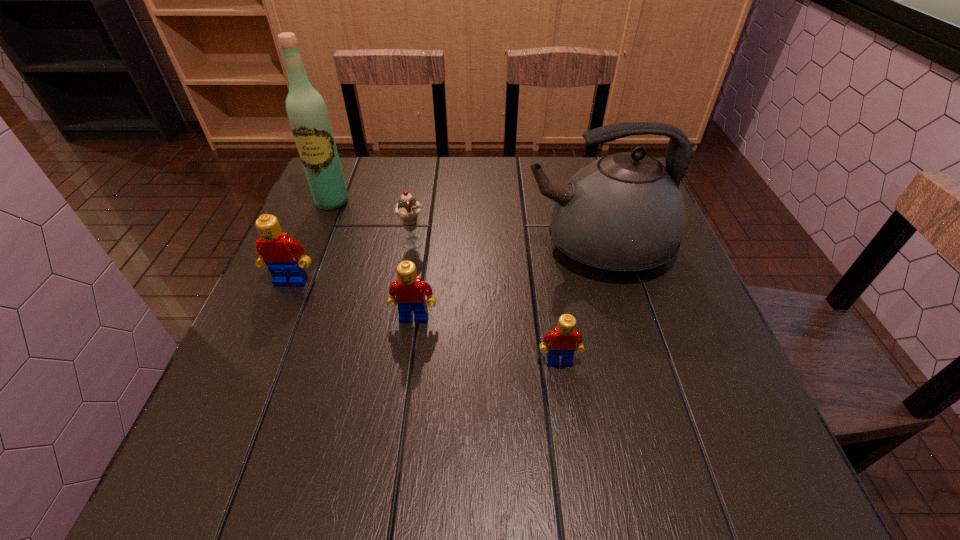
Find the location of a particular element. This screenshot has height=540, width=960. vacant position located on the front-facing side of the second nearest Lego is located at coordinates (402, 409).

Locate an element on the screen. Image resolution: width=960 pixels, height=540 pixels. vacant space located on the front-facing side of the shortest object is located at coordinates (564, 398).

Find the location of a particular element. The image size is (960, 540). blank area located 0.270m on the front-facing side of the tallest object is located at coordinates (298, 289).

Where is `free space located at the spout of the fifth shortest object`? The height and width of the screenshot is (540, 960). free space located at the spout of the fifth shortest object is located at coordinates (471, 247).

I want to click on vacant space positioned 0.380m at the spout of the fifth shortest object, so click(x=361, y=247).

Identify the location of free space located 0.360m at the spout of the fifth shortest object. (370, 247).

Locate an element on the screen. The height and width of the screenshot is (540, 960). free point located on the back of the icecream is located at coordinates (424, 173).

Find the location of `object located at the far edge`. object located at the far edge is located at coordinates (308, 116).

Find the location of a particular element. The image size is (960, 540). Lego situated at the left edge is located at coordinates (276, 249).

At what (x,y) coordinates should I click in order to perform the action: click on wine bottle that is positioned at the left edge. Please return your answer as a coordinate pair (x, y). This screenshot has width=960, height=540. Looking at the image, I should click on (308, 116).